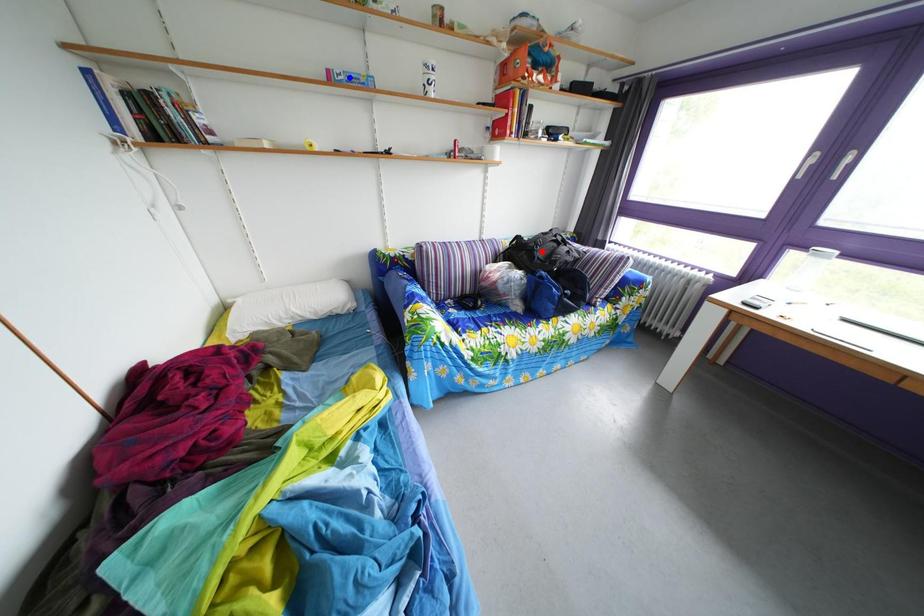
Question: Which of the two points in the image is closer to the camera?

Choices:
 (A) Blue point is closer.
 (B) Red point is closer.

Answer: (A)